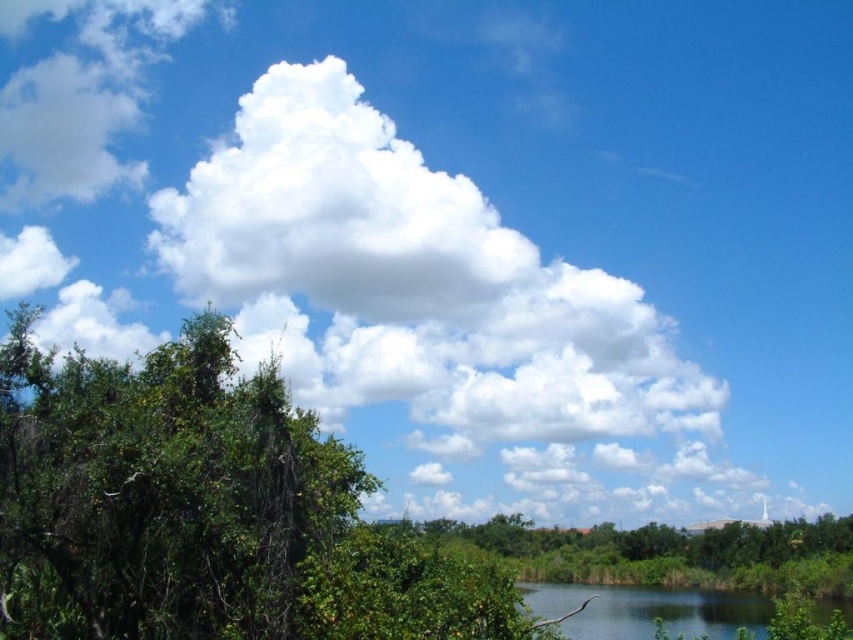
Consider the image. Between green leafy tree at left and green grassy river at lower right, which one is positioned higher?

Positioned higher is green leafy tree at left.

Who is more distant from viewer, (74, 566) or (578, 593)?

Point (578, 593)

At what (x,y) coordinates should I click in order to perform the action: click on green leafy tree at left. Please return your answer as a coordinate pair (x, y). Looking at the image, I should click on point(160,492).

Find the location of a particular element. This screenshot has height=640, width=853. green leafy tree at left is located at coordinates (160, 492).

Which is behind, point (224, 464) or point (692, 572)?

The point (692, 572) is more distant.

Between point (24, 588) and point (822, 536), which one is positioned behind?

The point (822, 536) is behind.

You are a GUI agent. You are given a task and a screenshot of the screen. Output one action in this format:
    pyautogui.click(x=<x>, y=<y>)
    Task: Click on the green leafy tree at left
    This screenshot has width=853, height=640.
    Given the screenshot: What is the action you would take?
    pyautogui.click(x=160, y=492)

Between green leafy tree at lower center and green grassy river at lower right, which one has more height?

Standing taller between the two is green grassy river at lower right.

Can you confirm if green leafy tree at lower center is smaller than green grassy river at lower right?

Correct, green leafy tree at lower center occupies less space than green grassy river at lower right.

Identify the location of green leafy tree at lower center. (668, 554).